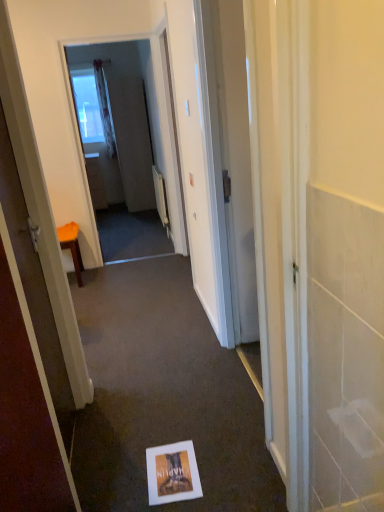
Where is `matte cardboard postcard at center`? This screenshot has height=512, width=384. matte cardboard postcard at center is located at coordinates (172, 473).

What is the approximate height of matte cardboard postcard at center?

matte cardboard postcard at center is 0.64 inches in height.

This screenshot has width=384, height=512. What are the coordinates of `matte white screen door at upper center, the second screen door from the back` in the screenshot? It's located at (147, 109).

Between matte cardboard postcard at center and matte gray screen door at center, which is the first screen door in back-to-front order, which one has more height?

matte gray screen door at center, which is the first screen door in back-to-front order, is taller.

From a real-world perspective, is matte cardboard postcard at center located higher than matte gray screen door at center, acting as the second screen door starting from the front?

No.

Based on the photo, considering the positions of objects matte cardboard postcard at center and matte gray screen door at center, acting as the second screen door starting from the front, in the image provided, who is in front, matte cardboard postcard at center or matte gray screen door at center, acting as the second screen door starting from the front,?

matte cardboard postcard at center.

In the scene shown: Is matte cardboard postcard at center not near matte gray screen door at center, acting as the second screen door starting from the front?

That's right, there is a large distance between matte cardboard postcard at center and matte gray screen door at center, acting as the second screen door starting from the front.

Measure the distance between orange fabric stool at left and matte gray screen door at center, which is the first screen door in back-to-front order.

The distance of orange fabric stool at left from matte gray screen door at center, which is the first screen door in back-to-front order, is 9.62 feet.

Is matte gray screen door at center, which is the first screen door in back-to-front order, at the back of orange fabric stool at left?

No, matte gray screen door at center, which is the first screen door in back-to-front order, is not at the back of orange fabric stool at left.

Is orange fabric stool at left completely or partially outside of matte gray screen door at center, acting as the second screen door starting from the front?

orange fabric stool at left lies outside matte gray screen door at center, acting as the second screen door starting from the front,'s area.

Image resolution: width=384 pixels, height=512 pixels. Find the location of `the 1st screen door directly above the orange fabric stool at left (from a real-world perspective)`. the 1st screen door directly above the orange fabric stool at left (from a real-world perspective) is located at coordinates (131, 139).

Which is nearer, (154,84) or (78,230)?

Point (154,84) appears to be farther away from the viewer than point (78,230).

Find the location of a particular element. The width and height of the screenshot is (384, 512). the 2nd screen door directly above the orange fabric stool at left (from a real-world perspective) is located at coordinates tap(147, 109).

Does matte white screen door at upper center, the second screen door from the back, touch orange fabric stool at left?

matte white screen door at upper center, the second screen door from the back, is not next to orange fabric stool at left, and they're not touching.

From the image's perspective, relative to matte cardboard postcard at center, is matte gray screen door at center, which is the first screen door in back-to-front order, above or below?

Clearly, from the image's perspective, matte gray screen door at center, which is the first screen door in back-to-front order, is above matte cardboard postcard at center.

Which object is further away from the camera taking this photo, matte gray screen door at center, which is the first screen door in back-to-front order, or matte cardboard postcard at center?

matte gray screen door at center, which is the first screen door in back-to-front order, is more distant.

Considering the positions of point (150, 168) and point (155, 462), is point (150, 168) closer or farther from the camera than point (155, 462)?

Point (150, 168).

Can you see matte cardboard postcard at center touching matte white screen door at upper center, the second screen door from the back?

No, matte cardboard postcard at center is not next to matte white screen door at upper center, the second screen door from the back.

Can you confirm if matte cardboard postcard at center is thinner than matte white screen door at upper center, the second screen door from the back?

No, matte cardboard postcard at center is not thinner than matte white screen door at upper center, the second screen door from the back.

Is orange fabric stool at left bigger than matte cardboard postcard at center?

Correct, orange fabric stool at left is larger in size than matte cardboard postcard at center.

Looking at this image, between orange fabric stool at left and matte cardboard postcard at center, which one appears on the right side from the viewer's perspective?

Positioned to the right is matte cardboard postcard at center.

Is orange fabric stool at left far from matte cardboard postcard at center?

Yes, orange fabric stool at left and matte cardboard postcard at center are quite far apart.

From a real-world perspective, is matte gray screen door at center, which is the first screen door in back-to-front order, under matte white screen door at upper center, the second screen door from the back?

Indeed, from a real-world perspective, matte gray screen door at center, which is the first screen door in back-to-front order, is positioned beneath matte white screen door at upper center, the second screen door from the back.

Based on the photo, is matte gray screen door at center, which is the first screen door in back-to-front order, closer to camera compared to matte white screen door at upper center, the second screen door from the back?

No.

Between matte gray screen door at center, acting as the second screen door starting from the front, and matte white screen door at upper center, the second screen door from the back, which one has larger width?

matte gray screen door at center, acting as the second screen door starting from the front, is wider.

Which of these two, matte gray screen door at center, acting as the second screen door starting from the front, or matte white screen door at upper center, the second screen door from the back, stands shorter?

matte gray screen door at center, acting as the second screen door starting from the front.

I want to click on postcard below the matte gray screen door at center, acting as the second screen door starting from the front (from a real-world perspective), so click(x=172, y=473).

Locate an element on the screen. The height and width of the screenshot is (512, 384). screen door located behind the orange fabric stool at left is located at coordinates (131, 139).

Looking at this image, based on their spatial positions, is matte white screen door at upper center, the second screen door from the back, or matte gray screen door at center, acting as the second screen door starting from the front, closer to orange fabric stool at left?

The object closer to orange fabric stool at left is matte white screen door at upper center, the second screen door from the back.

Which object lies further to the anchor point matte cardboard postcard at center, matte gray screen door at center, acting as the second screen door starting from the front, or orange fabric stool at left?

matte gray screen door at center, acting as the second screen door starting from the front, is positioned further to the anchor matte cardboard postcard at center.

Which object lies nearer to the anchor point matte gray screen door at center, acting as the second screen door starting from the front, matte cardboard postcard at center or orange fabric stool at left?

orange fabric stool at left is closer to matte gray screen door at center, acting as the second screen door starting from the front.

When comparing their distances from matte white screen door at upper center, the 1th screen door from the front, does matte cardboard postcard at center or orange fabric stool at left seem closer?

Among the two, orange fabric stool at left is located nearer to matte white screen door at upper center, the 1th screen door from the front.

When comparing their distances from orange fabric stool at left, does matte cardboard postcard at center or matte white screen door at upper center, the second screen door from the back, seem further?

matte cardboard postcard at center.

From the image, which object appears to be nearer to matte cardboard postcard at center, matte gray screen door at center, which is the first screen door in back-to-front order, or matte white screen door at upper center, the second screen door from the back?

matte white screen door at upper center, the second screen door from the back, is closer to matte cardboard postcard at center.

Based on the photo, considering their positions, is matte cardboard postcard at center positioned closer to orange fabric stool at left than matte gray screen door at center, which is the first screen door in back-to-front order?

matte cardboard postcard at center.

Estimate the real-world distances between objects in this image. Which object is closer to matte gray screen door at center, which is the first screen door in back-to-front order, orange fabric stool at left or matte white screen door at upper center, the second screen door from the back?

Among the two, matte white screen door at upper center, the second screen door from the back, is located nearer to matte gray screen door at center, which is the first screen door in back-to-front order.

You are a GUI agent. You are given a task and a screenshot of the screen. Output one action in this format:
    pyautogui.click(x=<x>, y=<y>)
    Task: Click on the furniture between matte cardboard postcard at center and matte gray screen door at center, acting as the second screen door starting from the front, in the front-back direction
    
    Given the screenshot: What is the action you would take?
    pyautogui.click(x=72, y=246)

This screenshot has height=512, width=384. I want to click on furniture located between matte white screen door at upper center, the second screen door from the back, and matte gray screen door at center, acting as the second screen door starting from the front, in the depth direction, so pos(72,246).

Where is `screen door between matte cardboard postcard at center and matte gray screen door at center, acting as the second screen door starting from the front, from front to back`? screen door between matte cardboard postcard at center and matte gray screen door at center, acting as the second screen door starting from the front, from front to back is located at coordinates (147, 109).

Where is `screen door between matte cardboard postcard at center and orange fabric stool at left along the z-axis`? screen door between matte cardboard postcard at center and orange fabric stool at left along the z-axis is located at coordinates (147, 109).